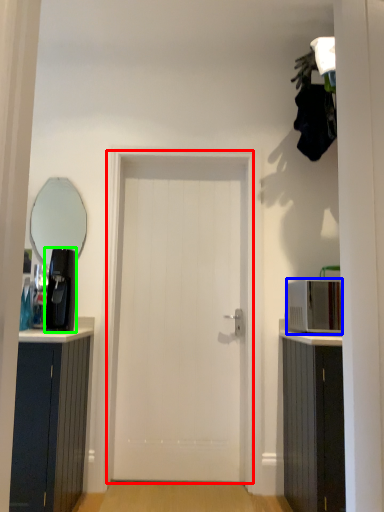
Question: Considering the real-world distances, which object is closest to door (highlighted by a red box)? appliance (highlighted by a blue box) or coffee machine (highlighted by a green box).

Choices:
 (A) appliance
 (B) coffee machine

Answer: (B)